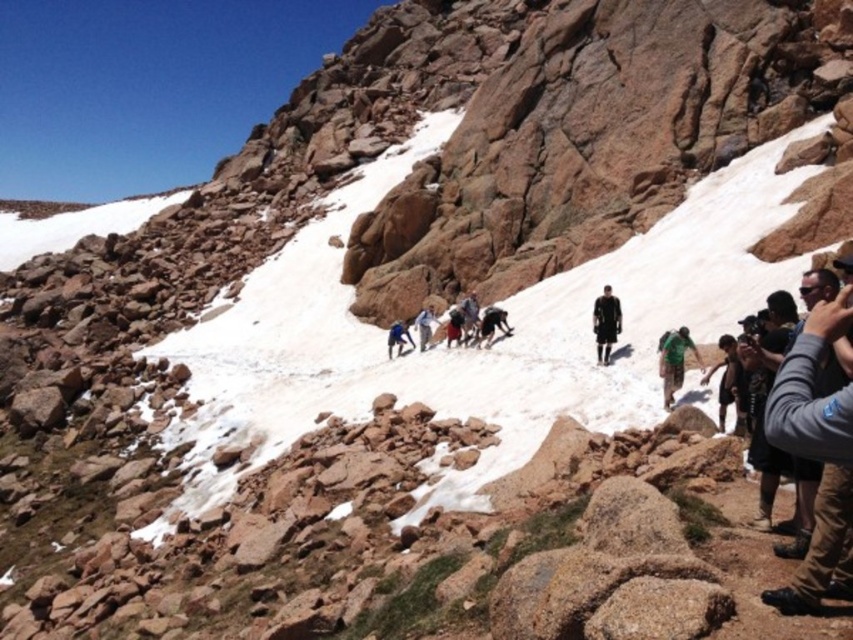
Question: Does gray fabric jacket at lower right appear over green fabric backpack at center?

Choices:
 (A) yes
 (B) no

Answer: (B)

Question: Which point appears farthest from the camera in this image?

Choices:
 (A) (679, 372)
 (B) (851, 445)

Answer: (A)

Question: Among these points, which one is nearest to the camera?

Choices:
 (A) (671, 372)
 (B) (840, 438)

Answer: (B)

Question: Among these points, which one is farthest from the camera?

Choices:
 (A) (677, 353)
 (B) (808, 557)

Answer: (A)

Question: Does gray fabric jacket at lower right lie in front of green fabric backpack at center?

Choices:
 (A) yes
 (B) no

Answer: (A)

Question: Observing the image, what is the correct spatial positioning of gray fabric jacket at lower right in reference to green fabric backpack at center?

Choices:
 (A) right
 (B) left

Answer: (A)